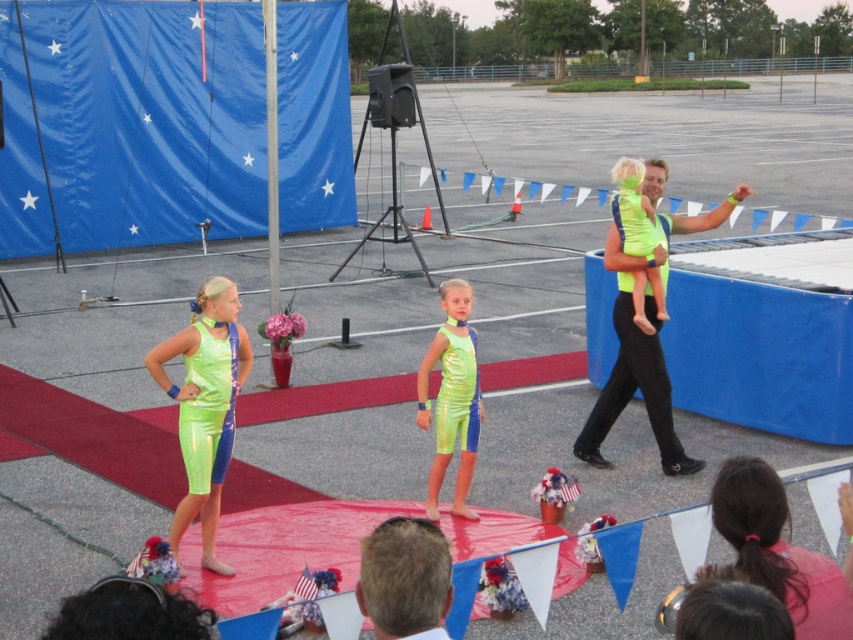
Question: Which of the following is the closest to the observer?

Choices:
 (A) (184, 420)
 (B) (784, 573)
 (C) (631, 320)
 (D) (233, 435)

Answer: (B)

Question: Is blue fabric flag at upper left below neon green shiny dress at center?

Choices:
 (A) no
 (B) yes

Answer: (A)

Question: Does neon green spandex at center have a greater width compared to neon green shiny dress at center?

Choices:
 (A) yes
 (B) no

Answer: (A)

Question: Which of the following is the closest to the observer?

Choices:
 (A) (442, 396)
 (B) (456, 368)

Answer: (B)

Question: Which point is closer to the camera?

Choices:
 (A) (190, 410)
 (B) (442, 376)
 (C) (795, 564)

Answer: (C)

Question: Can you confirm if neon green spandex at center is positioned to the right of neon green shiny dress at center?

Choices:
 (A) no
 (B) yes

Answer: (B)